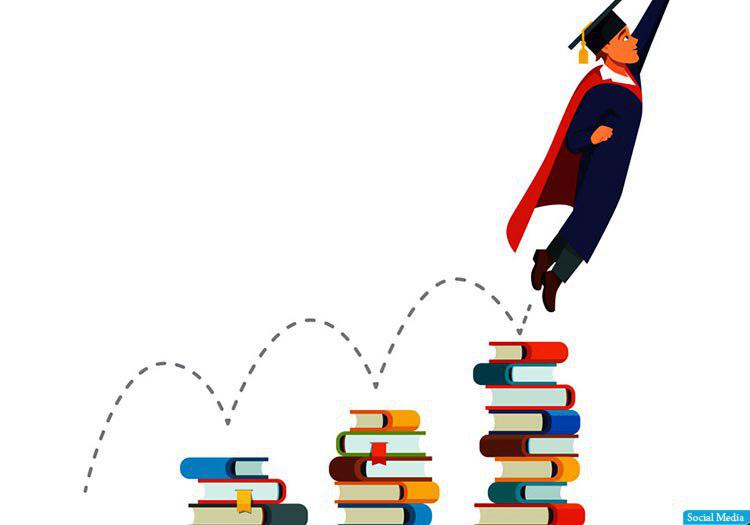
Where is `biggest stack of books`? biggest stack of books is located at coordinates (538, 511), (531, 489), (531, 469), (524, 446), (529, 424), (528, 400), (530, 370), (532, 353).